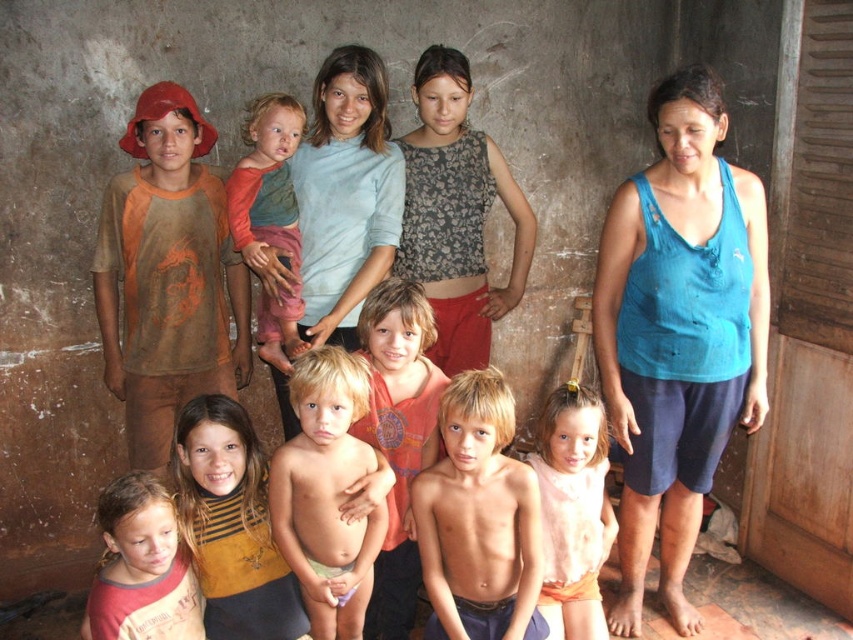
Question: Which of the following is the closest to the observer?

Choices:
 (A) orange long-sleeve shirt at center
 (B) blue fabric tank top at right
 (C) orange cotton shirt at center
 (D) pink fabric dress at lower center

Answer: (B)

Question: Which object is farther from the camera taking this photo?

Choices:
 (A) light brown skin boy at center
 (B) orange long-sleeve shirt at center
 (C) orange cotton shirt at center

Answer: (B)

Question: Is orange cotton shirt at center smaller than light brown skin at center?

Choices:
 (A) yes
 (B) no

Answer: (B)

Question: Can you confirm if light brown skin boy at center is wider than light brown skin at center?

Choices:
 (A) no
 (B) yes

Answer: (B)

Question: Which object appears farthest from the camera in this image?

Choices:
 (A) blue fabric tank top at right
 (B) orange cotton shirt at center
 (C) blonde hair baby at center
 (D) orange long-sleeve shirt at center

Answer: (D)

Question: Is light brown skin boy at center bigger than orange cotton shirt at center?

Choices:
 (A) no
 (B) yes

Answer: (A)